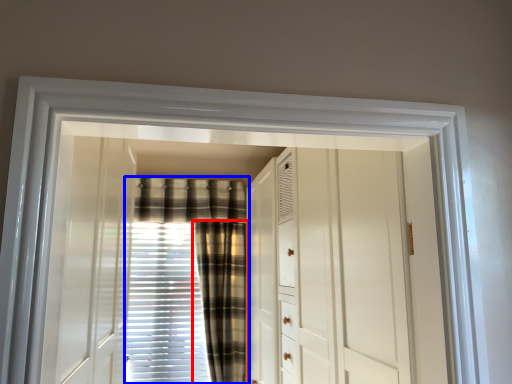
Question: Which point is further to the camera, curtain (highlighted by a red box) or curtain (highlighted by a blue box)?

Choices:
 (A) curtain
 (B) curtain

Answer: (B)